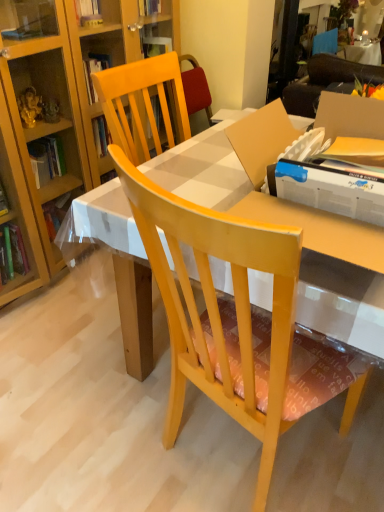
Question: In terms of size, does light wood chair at center appear bigger or smaller than brown fabric couch at upper right?

Choices:
 (A) big
 (B) small

Answer: (A)

Question: From the image's perspective, is light wood chair at center above or below brown fabric couch at upper right?

Choices:
 (A) above
 (B) below

Answer: (B)

Question: Estimate the real-world distances between objects in this image. Which object is farther from the light wood chair at center?

Choices:
 (A) brown fabric couch at upper right
 (B) green leafy plant at upper right

Answer: (B)

Question: Considering the real-world distances, which object is farthest from the light wood chair at center?

Choices:
 (A) brown fabric couch at upper right
 (B) green leafy plant at upper right

Answer: (B)